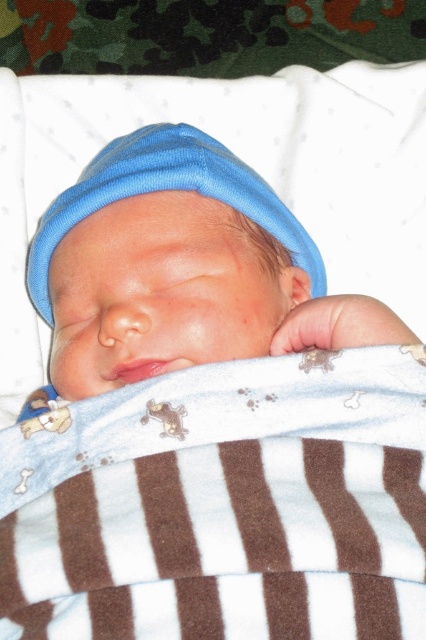
Question: Where is brown striped fabric at center located in relation to matte blue knit hat at center in the image?

Choices:
 (A) below
 (B) above

Answer: (A)

Question: Is brown striped fabric at center smaller than matte blue knit hat at center?

Choices:
 (A) yes
 (B) no

Answer: (A)

Question: Is brown striped fabric at center wider than matte blue knit hat at center?

Choices:
 (A) yes
 (B) no

Answer: (A)